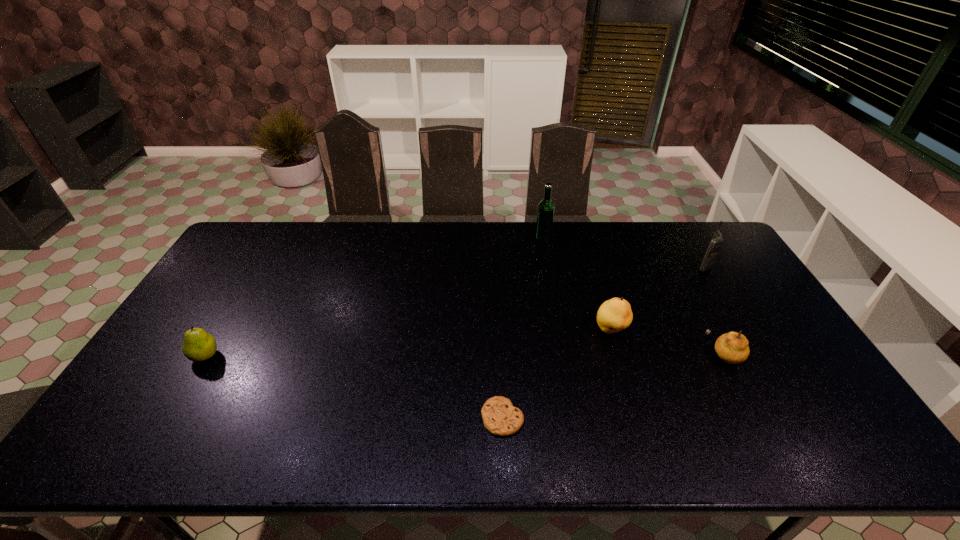
At what (x,y) coordinates should I click in order to perform the action: click on unoccupied area between the second object from left to right and the second farthest object. Please return your answer as a coordinate pair (x, y). Image resolution: width=960 pixels, height=540 pixels. Looking at the image, I should click on (603, 342).

At what (x,y) coordinates should I click in order to perform the action: click on free point between the beer bottle and the second pear from left to right. Please return your answer as a coordinate pair (x, y). Looking at the image, I should click on (577, 284).

This screenshot has width=960, height=540. Identify the location of blank region between the second pear from right to left and the leftmost object. (408, 343).

This screenshot has width=960, height=540. Find the location of `free spot between the cookie and the farthest object`. free spot between the cookie and the farthest object is located at coordinates (522, 328).

The height and width of the screenshot is (540, 960). Identify the location of unoccupied area between the nearest object and the fifth nearest object. (603, 342).

In order to click on vacant point located between the leftmost object and the shortest object in this screenshot , I will do `click(354, 387)`.

Find the location of a particular element. free space between the rightmost pear and the second object from left to right is located at coordinates (613, 386).

Where is `empty location between the fifth shortest object and the leftmost object`? The image size is (960, 540). empty location between the fifth shortest object and the leftmost object is located at coordinates click(454, 311).

Where is `object that stands as the third closest to the fifth object from left to right`? The height and width of the screenshot is (540, 960). object that stands as the third closest to the fifth object from left to right is located at coordinates (500, 417).

Identify which object is the closest to the fifth object from left to right. Please provide its 2D coordinates. Your answer should be formatted as a tuple, i.e. [(x, y)], where the tuple contains the x and y coordinates of a point satisfying the conditions above.

[(614, 315)]